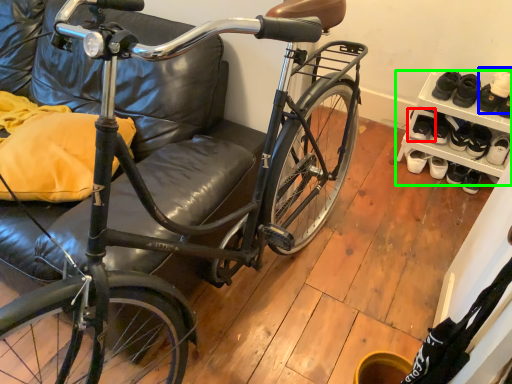
Question: Which object is positioned farthest from footwear (highlighted by a red box)? Select from shoe (highlighted by a blue box) and shelf (highlighted by a green box).

Choices:
 (A) shoe
 (B) shelf

Answer: (A)